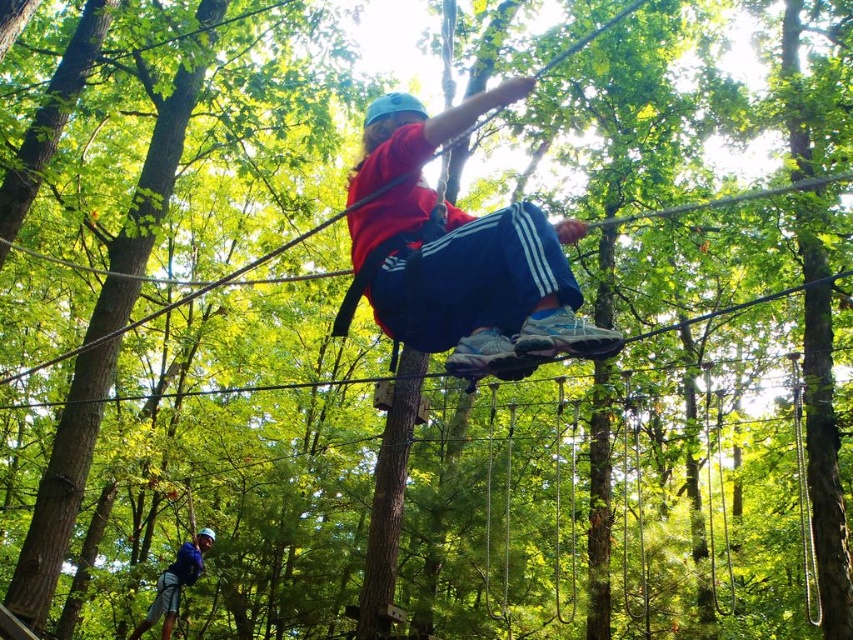
Can you confirm if matte red shirt at center is positioned to the left of blue fabric helmet at lower left?

No, matte red shirt at center is not to the left of blue fabric helmet at lower left.

Does matte red shirt at center appear under blue fabric helmet at lower left?

No.

The width and height of the screenshot is (853, 640). What do you see at coordinates (459, 253) in the screenshot? I see `matte red shirt at center` at bounding box center [459, 253].

The height and width of the screenshot is (640, 853). In order to click on matte red shirt at center in this screenshot , I will do `click(459, 253)`.